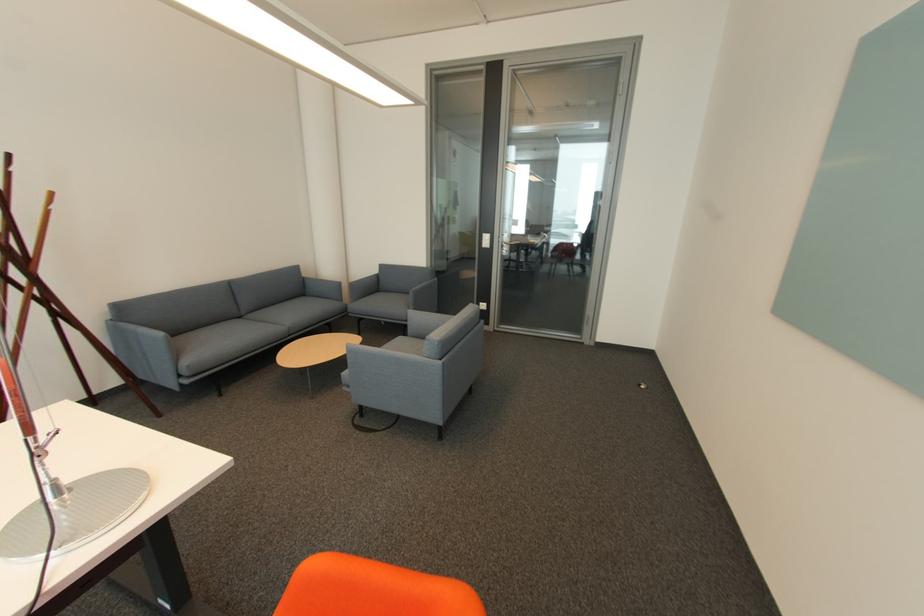
Describe the element at coordinates (322, 288) in the screenshot. I see `the grey sofa armrest` at that location.